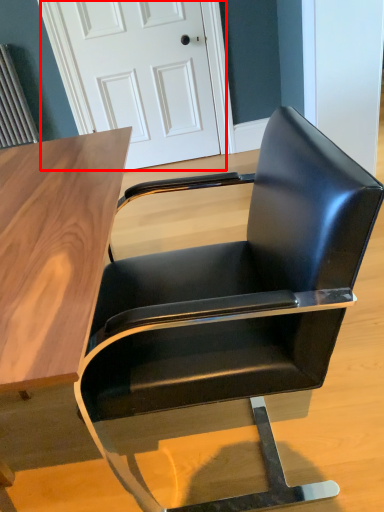
Question: From the image, what is the correct spatial relationship of door (annotated by the red box) in relation to chair?

Choices:
 (A) right
 (B) left

Answer: (B)